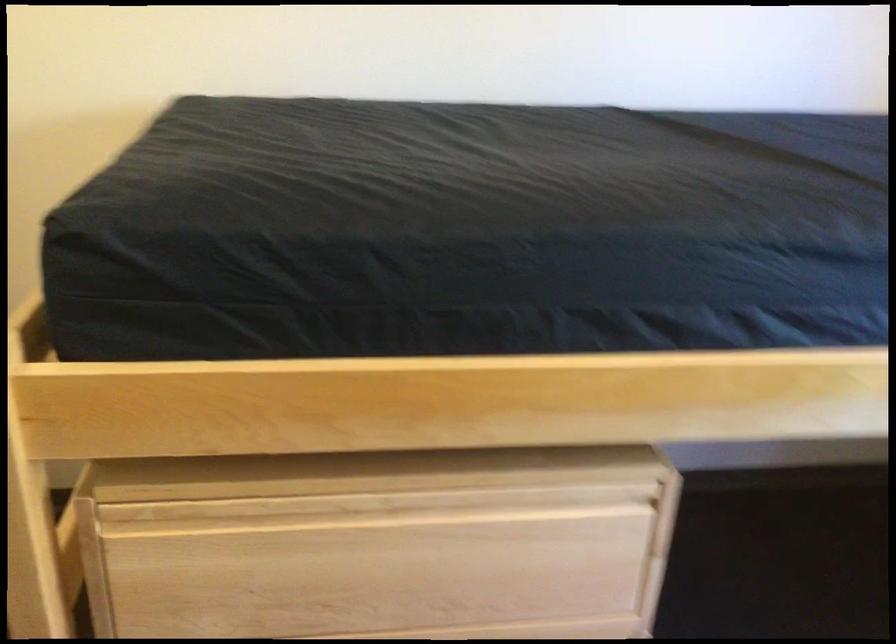
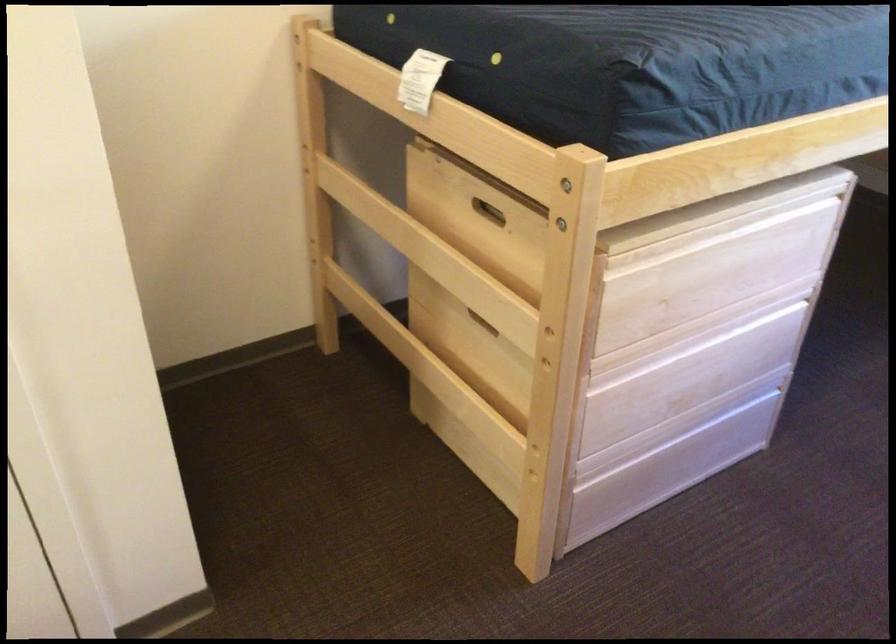
Question: In a continuous first-person perspective shot, in which direction is the camera moving?

Choices:
 (A) Left
 (B) Right
 (C) Forward
 (D) Backward

Answer: (A)